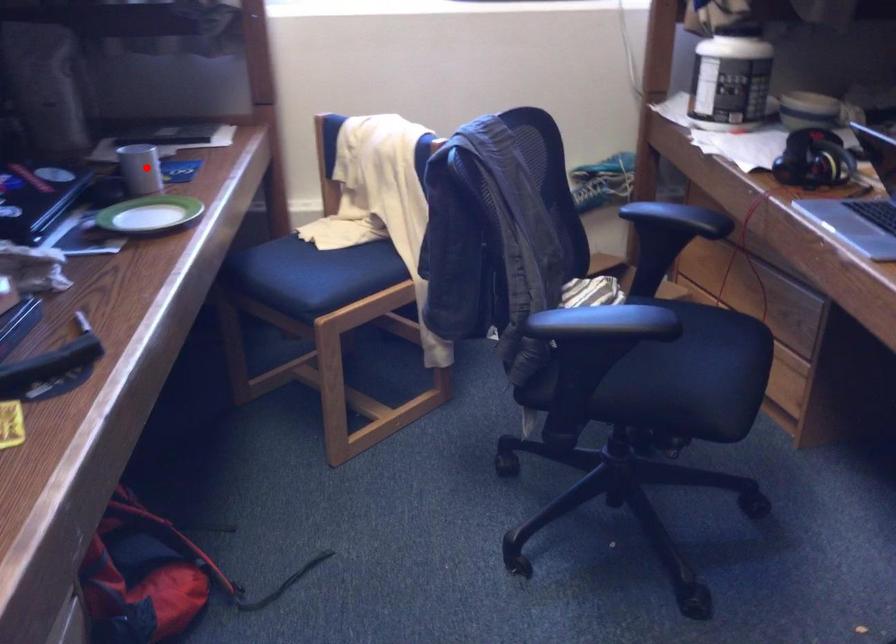
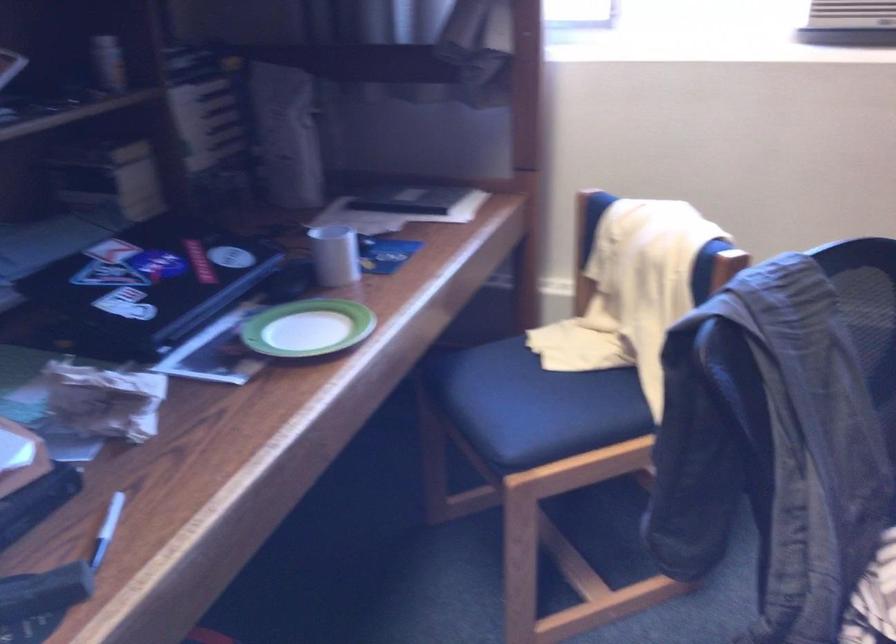
In the second image, find the point that corresponds to the highlighted location in the first image.

(334, 254)